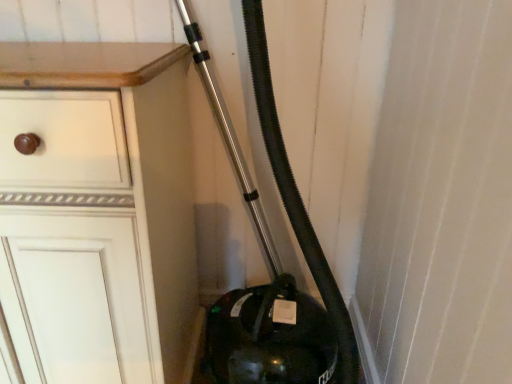
Find the location of a particular element. This screenshot has width=512, height=384. white wood chest of drawers at left is located at coordinates (97, 211).

This screenshot has height=384, width=512. Describe the element at coordinates (97, 211) in the screenshot. I see `white wood chest of drawers at left` at that location.

Measure the distance between white wood chest of drawers at left and camera.

The depth of white wood chest of drawers at left is 24.38 inches.

At what (x,y) coordinates should I click in order to perform the action: click on white wood chest of drawers at left. Please return your answer as a coordinate pair (x, y). Looking at the image, I should click on (97, 211).